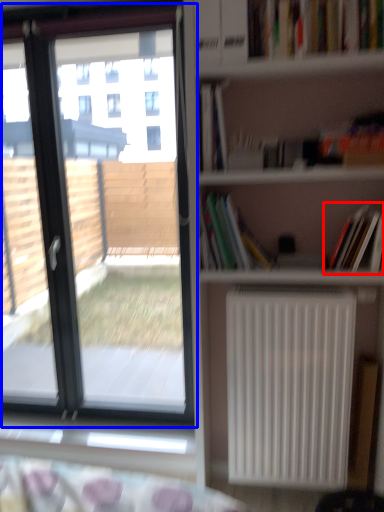
Question: Which point is further to the camera, book (highlighted by a red box) or window (highlighted by a blue box)?

Choices:
 (A) book
 (B) window

Answer: (B)